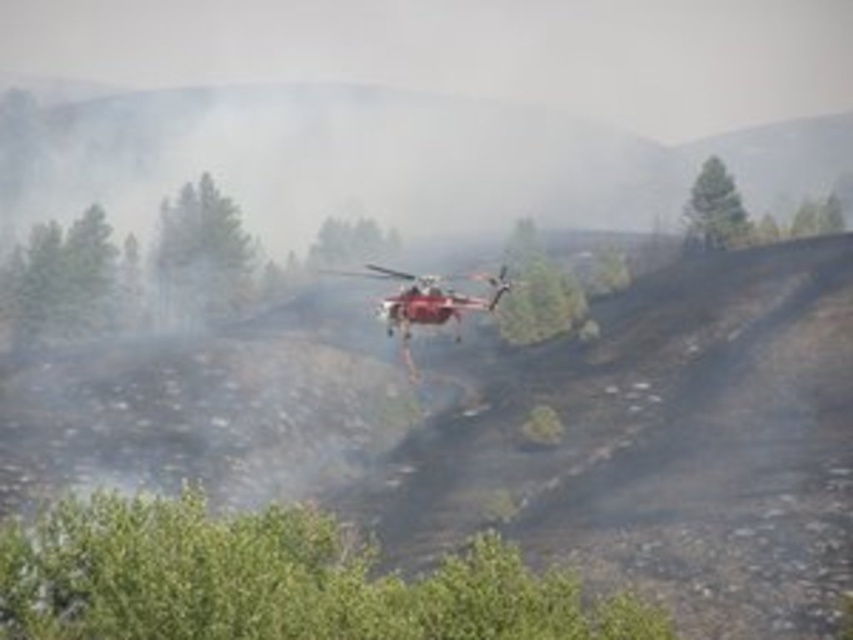
You are a firefighter in a helicopter trying to drop water on a fire. You see the metallic red helicopter at center and the green matte tree at center. Which object is closer to you, the firefighter, as you look out from the helicopter?

Both the metallic red helicopter at center and the green matte tree at center are at the same distance from you since they are described as being at the center in the scene.

You are a pilot flying the metallic red helicopter at center. You need to navigate around the green matte tree at center. Which direction should you turn to avoid it?

The metallic red helicopter at center is positioned on the right side of the green matte tree at center. To avoid the tree, you should turn to the left.

You are a pilot flying a helicopter over a wildfire area. You notice two green trees below. Which tree is positioned to the right when looking at the green textured tree at upper right and the green matte tree at center?

The green textured tree at upper right is positioned to the right of the green matte tree at center.